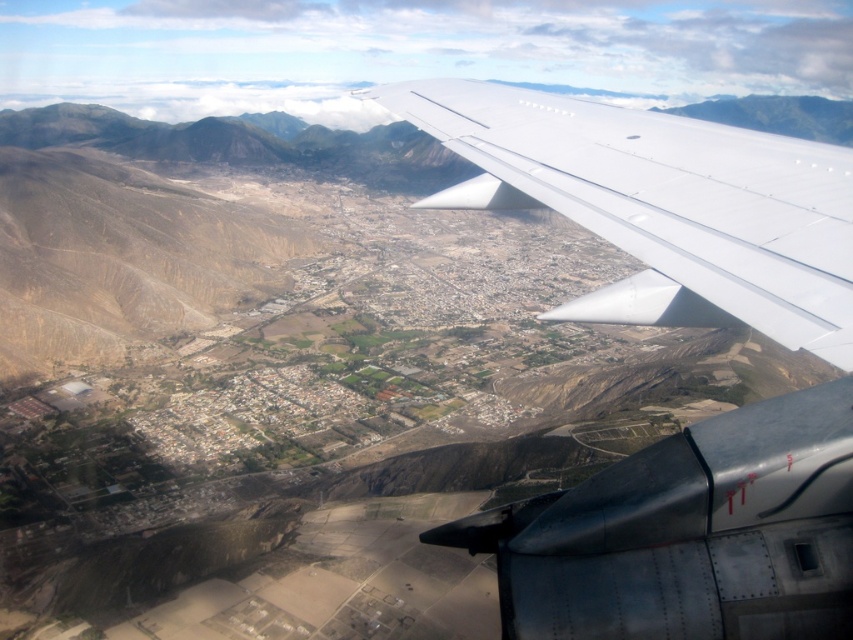
You are a passenger sitting by the window and want to take a photo of the white metallic wing at upper center and the transparent plastic airplane window at lower right. Which object will appear bigger in your photo?

The white metallic wing at upper center will appear bigger in the photo because it has a larger size compared to the transparent plastic airplane window at lower right.

In the scene shown: You are a pilot looking at the airplane window and see a point marked at coordinates (679, 324). What object does this point correspond to in the scene?

The point at coordinates (679, 324) corresponds to the white metallic wing at upper center.